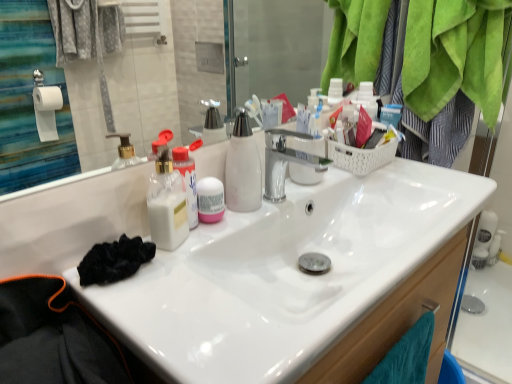
Question: Is point (205, 213) positioned closer to the camera than point (265, 241)?

Choices:
 (A) closer
 (B) farther

Answer: (A)

Question: From the image's perspective, is pink matte deodorant at center above or below white glossy sink at center?

Choices:
 (A) above
 (B) below

Answer: (A)

Question: From a real-world perspective, is pink matte deodorant at center above or below white glossy sink at center?

Choices:
 (A) below
 (B) above

Answer: (B)

Question: Is white glossy sink at center in front of or behind pink matte deodorant at center in the image?

Choices:
 (A) front
 (B) behind

Answer: (A)

Question: Is point (234, 294) closer or farther from the camera than point (202, 190)?

Choices:
 (A) closer
 (B) farther

Answer: (A)

Question: Considering the relative positions of white glossy sink at center and pink matte deodorant at center in the image provided, is white glossy sink at center to the left or to the right of pink matte deodorant at center?

Choices:
 (A) left
 (B) right

Answer: (B)

Question: Considering the positions of white glossy sink at center and pink matte deodorant at center in the image, is white glossy sink at center bigger or smaller than pink matte deodorant at center?

Choices:
 (A) big
 (B) small

Answer: (A)